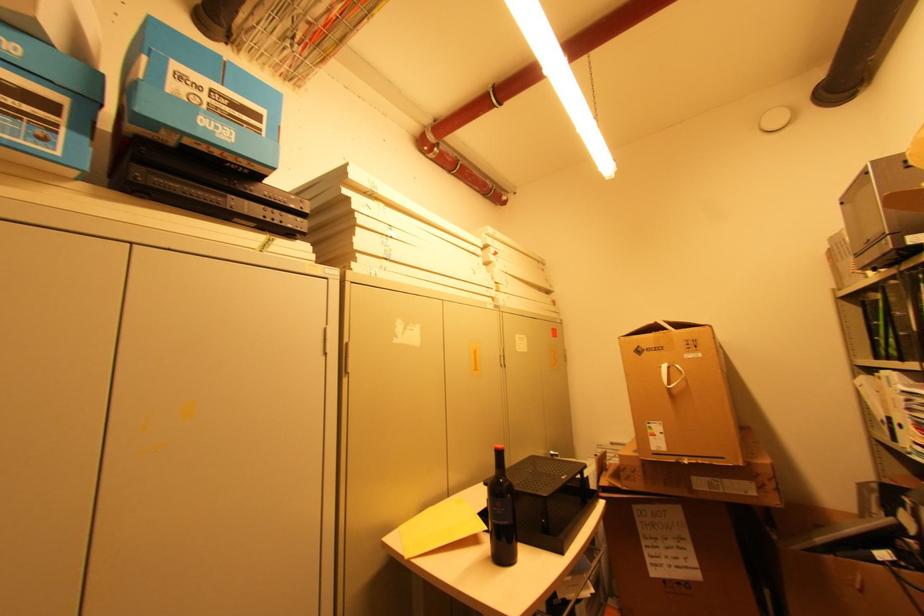
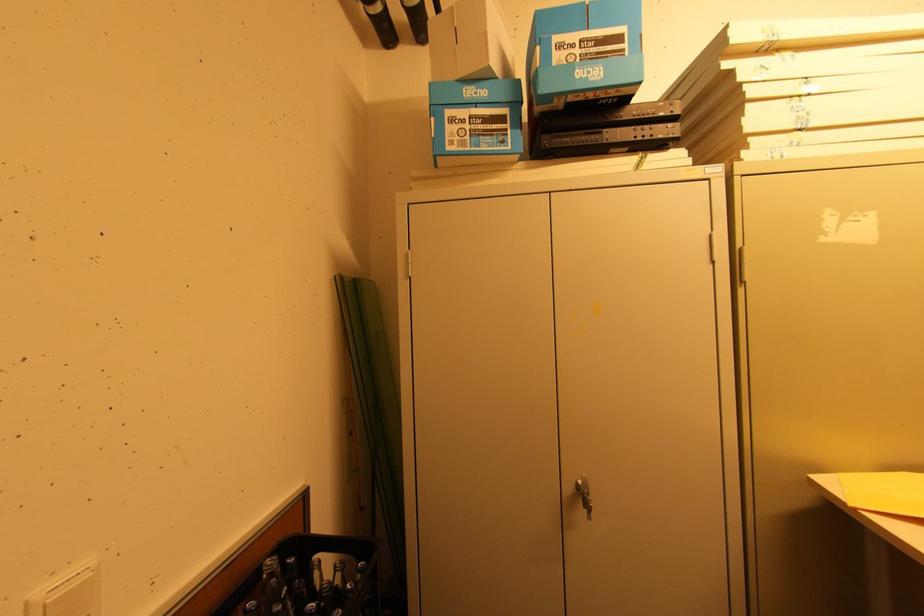
Locate, in the second image, the point that corresponds to (x=235, y=134) in the first image.

(603, 71)